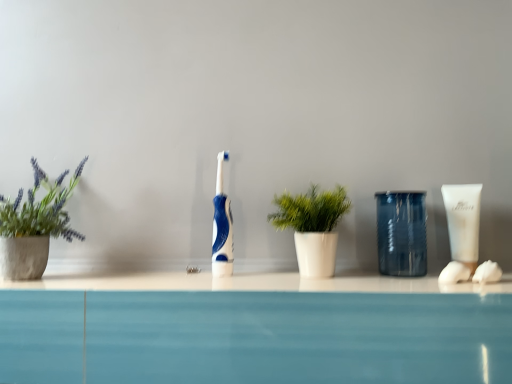
The width and height of the screenshot is (512, 384). I want to click on white matte plant at center, marked as the first houseplant in a right-to-left arrangement, so click(x=312, y=226).

Measure the distance between white cotton ball at right and camera.

They are 24.97 inches apart.

Image resolution: width=512 pixels, height=384 pixels. Find the location of `transparent textured glass at center right`. transparent textured glass at center right is located at coordinates (401, 233).

The width and height of the screenshot is (512, 384). What do you see at coordinates (34, 225) in the screenshot? I see `green matte plant at left, the 2th houseplant viewed from the right` at bounding box center [34, 225].

This screenshot has width=512, height=384. Identify the location of white matte plant at center, marked as the first houseplant in a right-to-left arrangement. (312, 226).

What's the angular difference between transparent textured glass at center right and blue glossy toothbrush at center's facing directions?

The angular difference between transparent textured glass at center right and blue glossy toothbrush at center is 0.29 degrees.

Is point (391, 195) less distant than point (231, 213)?

Yes, point (391, 195) is closer to viewer.

From their relative heights in the image, would you say transparent textured glass at center right is taller or shorter than blue glossy toothbrush at center?

In the image, transparent textured glass at center right appears to be shorter than blue glossy toothbrush at center.

Is transparent textured glass at center right facing towards blue glossy toothbrush at center?

No, transparent textured glass at center right is not aimed at blue glossy toothbrush at center.

Is point (452, 277) farther from camera compared to point (393, 213)?

No, it is not.

Does white matte tube at right turn towards transparent textured glass at center right?

No, white matte tube at right is not oriented towards transparent textured glass at center right.

Where is `glass vase located underneath the white matte tube at right (from a real-world perspective)`? Image resolution: width=512 pixels, height=384 pixels. glass vase located underneath the white matte tube at right (from a real-world perspective) is located at coordinates (401, 233).

Can you tell me how much white matte tube at right and transparent textured glass at center right differ in facing direction?

The angle between the facing direction of white matte tube at right and the facing direction of transparent textured glass at center right is 0.00428 degrees.

From a real-world perspective, which object rests below the other?

white matte plant at center, marked as the first houseplant in a right-to-left arrangement.

Can you tell me how much white matte tube at right and white matte plant at center, marked as the first houseplant in a right-to-left arrangement, differ in facing direction?

There is a 0.00347-degree angle between the facing directions of white matte tube at right and white matte plant at center, marked as the first houseplant in a right-to-left arrangement.

Who is smaller, white matte tube at right or white matte plant at center, which is the 2th houseplant in left-to-right order?

Smaller between the two is white matte tube at right.

Which is less distant, (493, 262) or (408, 208)?

Point (493, 262) appears to be farther away from the viewer than point (408, 208).

Is white cotton ball at right facing towards transparent textured glass at center right?

No.

Considering the sizes of white cotton ball at right and transparent textured glass at center right in the image, is white cotton ball at right bigger or smaller than transparent textured glass at center right?

Clearly, white cotton ball at right is smaller in size than transparent textured glass at center right.

What's the angular difference between white matte plant at center, which is the 2th houseplant in left-to-right order, and white cotton ball at right's facing directions?

white matte plant at center, which is the 2th houseplant in left-to-right order, and white cotton ball at right are facing 6.72 degrees away from each other.

Where is `soap directly beneath the white matte plant at center, which is the 2th houseplant in left-to-right order (from a real-world perspective)`? soap directly beneath the white matte plant at center, which is the 2th houseplant in left-to-right order (from a real-world perspective) is located at coordinates (487, 272).

Is white matte plant at center, which is the 2th houseplant in left-to-right order, directly adjacent to white cotton ball at right?

No, white matte plant at center, which is the 2th houseplant in left-to-right order, is not beside white cotton ball at right.

In the scene shown: Which object is closer to the camera taking this photo, white matte plant at center, marked as the first houseplant in a right-to-left arrangement, or white cotton ball at right?

white cotton ball at right is more forward.

Does point (469, 237) come closer to viewer compared to point (25, 214)?

Yes, it is in front of point (25, 214).

From a real-world perspective, is white matte tube at right physically below green matte plant at left, the 2th houseplant viewed from the right?

Yes, from a real-world perspective, white matte tube at right is beneath green matte plant at left, the 2th houseplant viewed from the right.

Who is bigger, white matte tube at right or green matte plant at left, the 2th houseplant viewed from the right?

green matte plant at left, the 2th houseplant viewed from the right.

From the picture: Does white matte tube at right have a greater height compared to green matte plant at left, which is the 1th houseplant from left to right?

No.

Is white matte tube at right beside blue glossy toothbrush at center?

No, white matte tube at right is not in contact with blue glossy toothbrush at center.

Considering the positions of objects white matte tube at right and blue glossy toothbrush at center in the image provided, who is more to the right, white matte tube at right or blue glossy toothbrush at center?

Positioned to the right is white matte tube at right.

From the picture: Considering the sizes of objects white matte tube at right and blue glossy toothbrush at center in the image provided, who is smaller, white matte tube at right or blue glossy toothbrush at center?

With smaller size is white matte tube at right.

Where is `toothbrush behind the transparent textured glass at center right`? The height and width of the screenshot is (384, 512). toothbrush behind the transparent textured glass at center right is located at coordinates (222, 225).

Find the location of a particular element. This screenshot has width=512, height=384. toiletry on the right side of transparent textured glass at center right is located at coordinates (462, 230).

From the image, which object appears to be farther from transparent textured glass at center right, blue glossy toothbrush at center or white matte plant at center, marked as the first houseplant in a right-to-left arrangement?

The object further to transparent textured glass at center right is blue glossy toothbrush at center.

From the picture: From the image, which object appears to be farther from white cotton ball at right, blue glossy toothbrush at center or white matte tube at right?

blue glossy toothbrush at center.

From the image, which object appears to be nearer to transparent textured glass at center right, blue glossy toothbrush at center or white matte tube at right?

white matte tube at right.

When comparing their distances from transparent textured glass at center right, does white matte plant at center, which is the 2th houseplant in left-to-right order, or green matte plant at left, which is the 1th houseplant from left to right, seem further?

green matte plant at left, which is the 1th houseplant from left to right.

When comparing their distances from green matte plant at left, which is the 1th houseplant from left to right, does blue glossy toothbrush at center or white matte plant at center, which is the 2th houseplant in left-to-right order, seem further?

Based on the image, white matte plant at center, which is the 2th houseplant in left-to-right order, appears to be further to green matte plant at left, which is the 1th houseplant from left to right.

Looking at the image, which one is located closer to transparent textured glass at center right, white matte plant at center, which is the 2th houseplant in left-to-right order, or white matte tube at right?

white matte tube at right.

Based on their spatial positions, is white matte plant at center, which is the 2th houseplant in left-to-right order, or green matte plant at left, the 2th houseplant viewed from the right, further from white cotton ball at right?

Based on the image, green matte plant at left, the 2th houseplant viewed from the right, appears to be further to white cotton ball at right.

Estimate the real-world distances between objects in this image. Which object is closer to white matte tube at right, white cotton ball at right or blue glossy toothbrush at center?

white cotton ball at right.

I want to click on soap between blue glossy toothbrush at center and white matte tube at right, so click(487, 272).

You are a GUI agent. You are given a task and a screenshot of the screen. Output one action in this format:
    pyautogui.click(x=<x>, y=<y>)
    Task: Click on the toothbrush between green matte plant at left, the 2th houseplant viewed from the right, and white cotton ball at right from left to right
    The width and height of the screenshot is (512, 384).
    Given the screenshot: What is the action you would take?
    222,225

The image size is (512, 384). I want to click on soap located between green matte plant at left, which is the 1th houseplant from left to right, and white matte tube at right in the left-right direction, so click(487, 272).

This screenshot has height=384, width=512. Find the location of `houseplant located between green matte plant at left, which is the 1th houseplant from left to right, and white cotton ball at right in the left-right direction`. houseplant located between green matte plant at left, which is the 1th houseplant from left to right, and white cotton ball at right in the left-right direction is located at coordinates (312, 226).